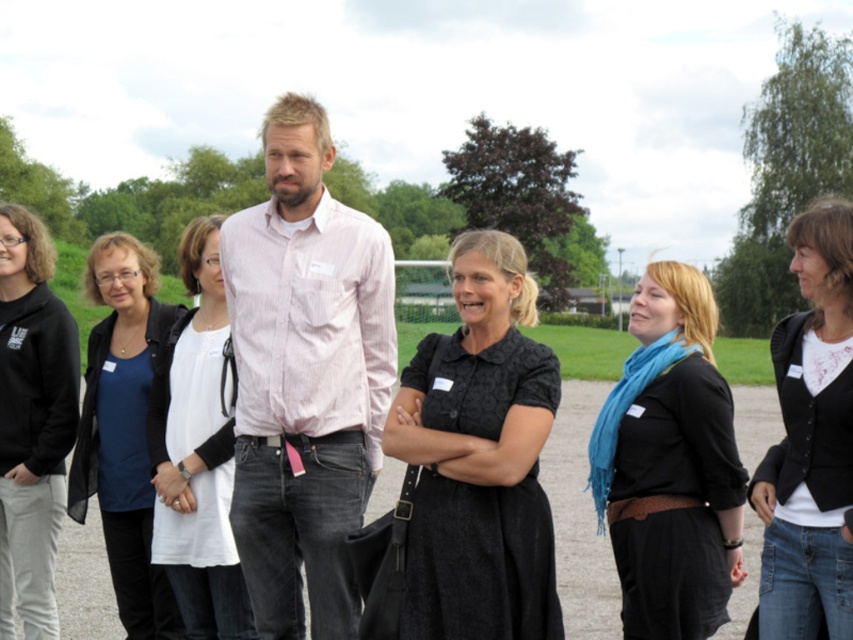
You are organizing a photo shoot and need to adjust the positions of the black textured dress at center and the black fleece at left to ensure proper lighting. Based on their current positions, which object is closer to the camera and should be moved first to avoid blocking the light?

The black textured dress at center is in front of the black fleece at left, so it is closer to the camera and should be moved first to avoid blocking the light.

You are a photographer trying to capture a group photo of the black matte jacket at right and the black fleece at left. Since you want both to appear the same size in the photo, where should you position yourself relative to them?

To make the black matte jacket at right and the black fleece at left appear the same size in the photo, you should position yourself closer to the black matte jacket at right because it is smaller than the black fleece at left.